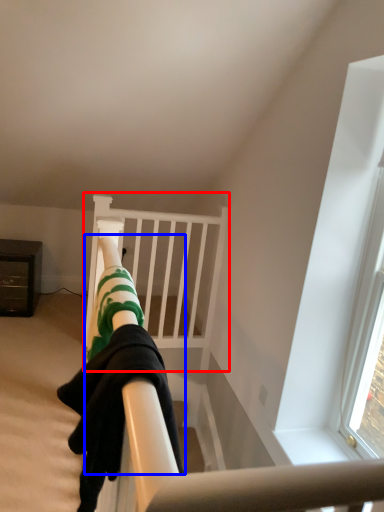
Question: Which of the following is the closest to the observer, bunk bed (highlighted by a red box) or person (highlighted by a blue box)?

Choices:
 (A) bunk bed
 (B) person

Answer: (B)